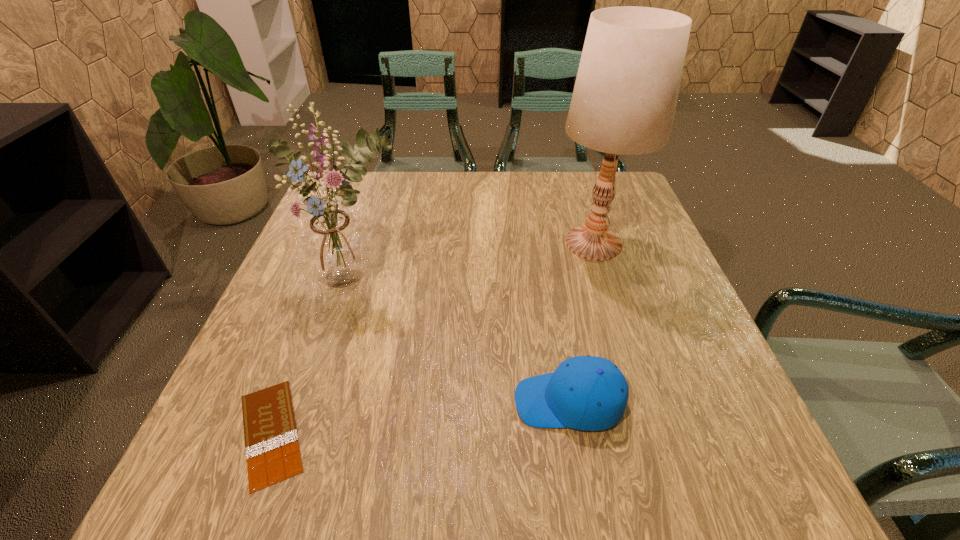
Identify the location of unoccupied position between the lamp and the second shortest object. (581, 322).

Image resolution: width=960 pixels, height=540 pixels. What are the coordinates of `free space between the bouquet and the chocolate bar` in the screenshot? It's located at (313, 357).

Where is `vacant region between the chocolate bar and the cap`? vacant region between the chocolate bar and the cap is located at coordinates (420, 417).

The height and width of the screenshot is (540, 960). I want to click on vacant point located between the tallest object and the shortest object, so click(432, 338).

This screenshot has height=540, width=960. I want to click on free space between the tallest object and the cap, so click(581, 322).

At what (x,y) coordinates should I click in order to perform the action: click on vacant point located between the shortest object and the third tallest object. Please return your answer as a coordinate pair (x, y). Looking at the image, I should click on (420, 417).

This screenshot has width=960, height=540. I want to click on free point between the tallest object and the third shortest object, so click(474, 262).

Select which object is the closest to the lamp. Please provide its 2D coordinates. Your answer should be formatted as a tuple, i.e. [(x, y)], where the tuple contains the x and y coordinates of a point satisfying the conditions above.

[(587, 393)]

Find the location of a particular element. object that is the second closest to the tallest object is located at coordinates (335, 247).

Identify the location of free spot that satisfies the following two spatial constraints: 1. on the front-facing side of the cap; 2. on the front side of the chocolate bar. (574, 433).